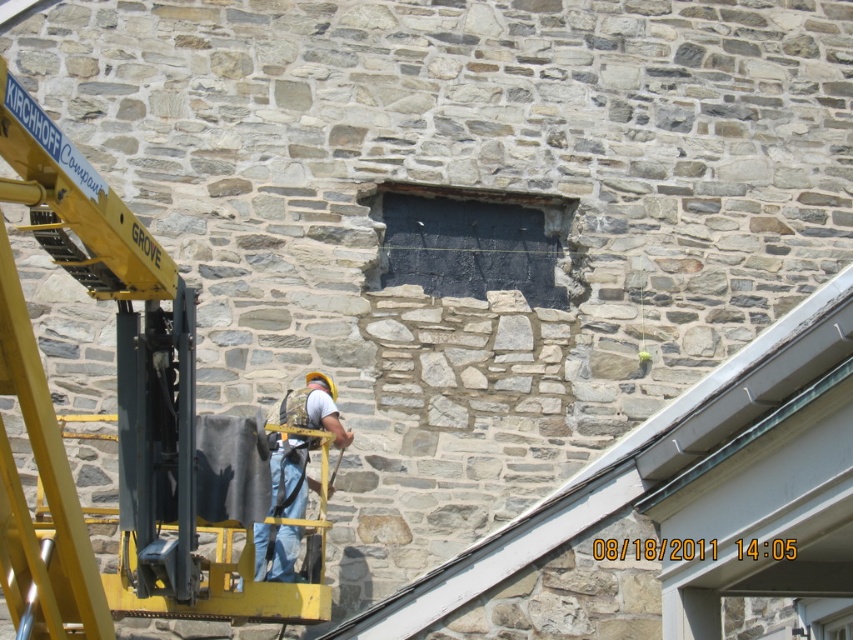
Is point (140, 269) positioned behind point (265, 576)?

No, (140, 269) is in front of (265, 576).

Is point (74, 268) closer to viewer compared to point (297, 449)?

That is True.

Where is `yellow metal crane at left`? The image size is (853, 640). yellow metal crane at left is located at coordinates (117, 413).

Who is more distant from viewer, (451, 192) or (276, 540)?

Point (451, 192)

Can you confirm if black stone hole at center is shorter than denim jeans at center?

Yes, black stone hole at center is shorter than denim jeans at center.

Between point (392, 216) and point (273, 412), which one is positioned in front?

Positioned in front is point (273, 412).

Locate an element on the screen. black stone hole at center is located at coordinates (471, 241).

Between yellow metal crane at left and black stone hole at center, which one has more height?

With more height is yellow metal crane at left.

Is yellow metal crane at left to the left of black stone hole at center from the viewer's perspective?

Yes, yellow metal crane at left is to the left of black stone hole at center.

The height and width of the screenshot is (640, 853). What do you see at coordinates (117, 413) in the screenshot?
I see `yellow metal crane at left` at bounding box center [117, 413].

Locate an element on the screen. yellow metal crane at left is located at coordinates (117, 413).